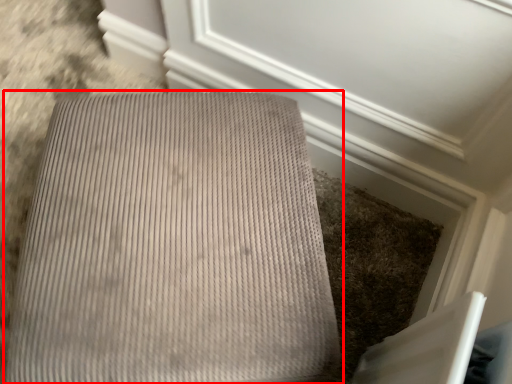
Question: In this image, where is furniture (annotated by the red box) located relative to screen door?

Choices:
 (A) right
 (B) left

Answer: (B)